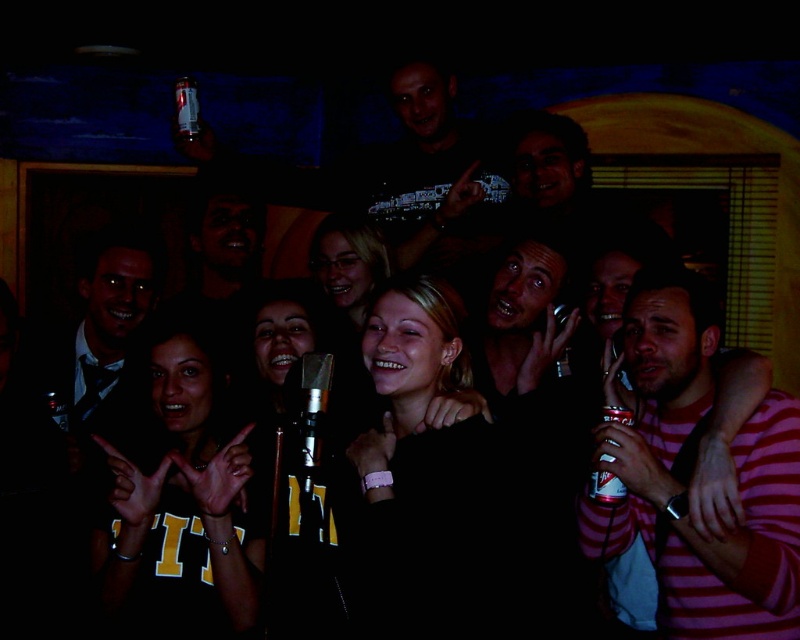
Question: Is striped cotton shirt at center bigger than smooth blonde hair at center?

Choices:
 (A) yes
 (B) no

Answer: (A)

Question: Estimate the real-world distances between objects in this image. Which object is farther from the striped cotton shirt at center?

Choices:
 (A) dark matte shirt at center
 (B) matte black microphone at center
 (C) smooth blonde hair at center

Answer: (A)

Question: Does black matte shirt at center have a greater width compared to matte black suit at left?

Choices:
 (A) yes
 (B) no

Answer: (B)

Question: Which point is closer to the camera taking this photo?

Choices:
 (A) (548, 250)
 (B) (302, 400)

Answer: (B)

Question: Which of the following is the farthest from the observer?

Choices:
 (A) (334, 604)
 (B) (418, 550)

Answer: (A)

Question: Is black matte jacket at center to the right of shiny metallic microphone at center from the viewer's perspective?

Choices:
 (A) no
 (B) yes

Answer: (B)